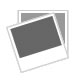
Where is `corners`? corners is located at coordinates (10, 29), (20, 57), (61, 44), (51, 16).